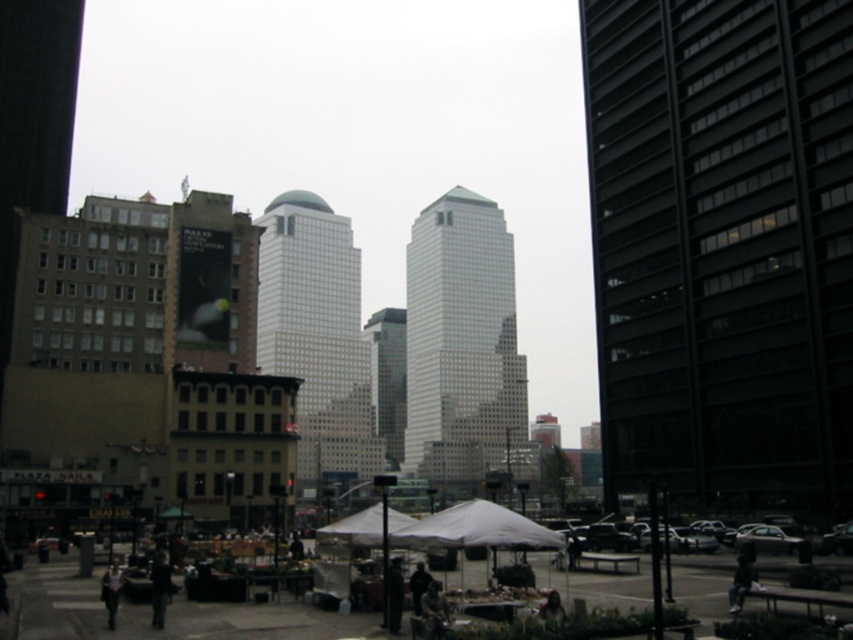
Question: Which of these objects is positioned closest to the dark blue jacket at center?

Choices:
 (A) camouflage fabric jacket at lower center
 (B) dark glass skyscraper at center
 (C) dark clothing at lower left
 (D) dark blue jeans at lower right

Answer: (A)

Question: Does white fabric tent at center have a lesser width compared to dark gray jacket at center?

Choices:
 (A) no
 (B) yes

Answer: (A)

Question: Which object appears closest to the camera in this image?

Choices:
 (A) white fabric canopy at center
 (B) dark blue jacket at center
 (C) green fabric umbrella at center

Answer: (C)

Question: Which of the following is the closest to the observer?

Choices:
 (A) white fabric canopy at center
 (B) dark gray jacket at center

Answer: (B)

Question: Can you confirm if dark blue jacket at center is wider than green fabric umbrella at center?

Choices:
 (A) no
 (B) yes

Answer: (A)

Question: Does dark clothing at lower left appear on the right side of dark blue jeans at lower right?

Choices:
 (A) yes
 (B) no

Answer: (B)